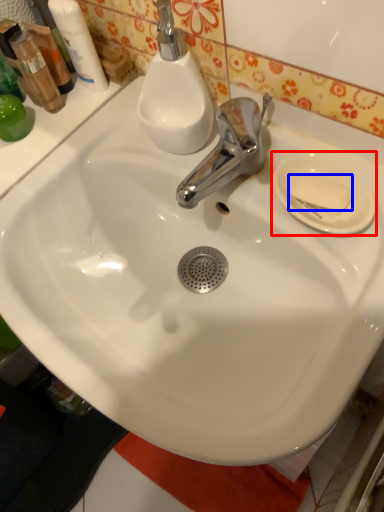
Question: Which of the following is the closest to the observer, plate (highlighted by a red box) or soap (highlighted by a blue box)?

Choices:
 (A) plate
 (B) soap

Answer: (A)